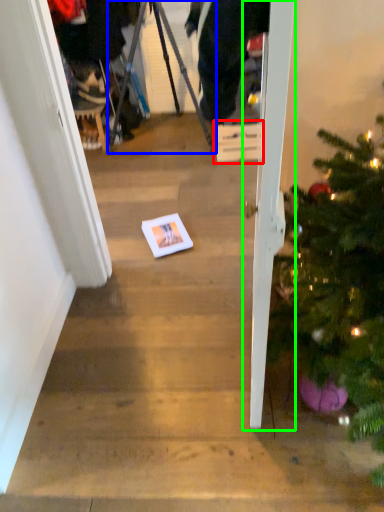
Question: Which is nearer to the cardboard box (highlighted by a red box)? tripod (highlighted by a blue box) or door (highlighted by a green box).

Choices:
 (A) tripod
 (B) door

Answer: (A)